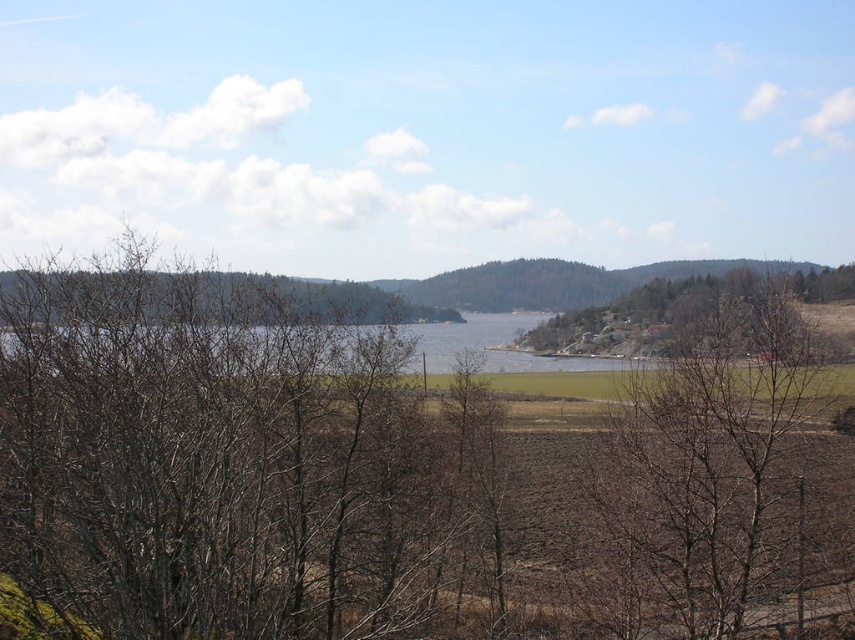
Looking at this image, can you confirm if brown bare branches at center is positioned to the right of brown leafless tree at center-right?

No, brown bare branches at center is not to the right of brown leafless tree at center-right.

Is point (249, 342) closer to camera compared to point (818, 276)?

Yes, point (249, 342) is in front of point (818, 276).

Find the location of a particular element. This screenshot has width=855, height=640. brown bare branches at center is located at coordinates (217, 461).

Measure the distance between brown bare branches at center and camera.

A distance of 11.00 meters exists between brown bare branches at center and camera.

Does point (292, 397) come in front of point (669, 456)?

That is False.

What do you see at coordinates (217, 461) in the screenshot? The width and height of the screenshot is (855, 640). I see `brown bare branches at center` at bounding box center [217, 461].

The width and height of the screenshot is (855, 640). I want to click on brown bare branches at center, so click(217, 461).

Which of these two, brown leafless tree at right or brown leafless tree at center-right, stands shorter?

brown leafless tree at center-right is shorter.

Is brown leafless tree at right thinner than brown leafless tree at center-right?

Yes, brown leafless tree at right is thinner than brown leafless tree at center-right.

Does point (730, 355) lie in front of point (590, 307)?

That is True.

The height and width of the screenshot is (640, 855). Find the location of `brown leafless tree at right`. brown leafless tree at right is located at coordinates (711, 465).